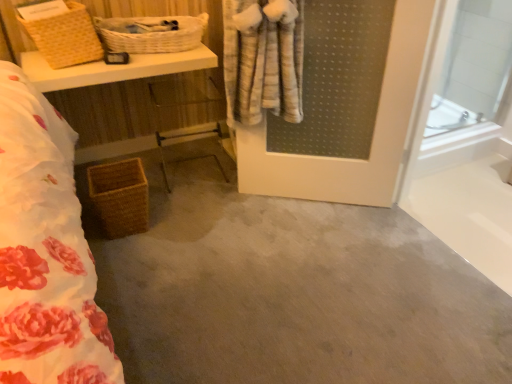
What do you see at coordinates (120, 197) in the screenshot?
I see `woven brown basket at lower left, the third basket in the top-to-bottom sequence` at bounding box center [120, 197].

Describe the element at coordinates (467, 139) in the screenshot. I see `transparent glass door at right` at that location.

The height and width of the screenshot is (384, 512). I want to click on white wicker basket at upper left, which is counted as the 1th basket, starting from the top, so click(151, 33).

The width and height of the screenshot is (512, 384). I want to click on woven brown basket at lower left, the third basket in the top-to-bottom sequence, so click(x=120, y=197).

From a real-world perspective, is white wicker basket at upper left, which is counted as the 1th basket, starting from the top, above or below woven brown basket at upper left, acting as the second basket starting from the bottom?

In terms of real-world spatial position, white wicker basket at upper left, which is counted as the 1th basket, starting from the top, is below woven brown basket at upper left, acting as the second basket starting from the bottom.

The width and height of the screenshot is (512, 384). There is a woven brown basket at upper left, marked as the second basket in a top-to-bottom arrangement. In order to click on the 1st basket below it (from a real-world perspective) in this screenshot , I will do `click(151, 33)`.

Between white wicker basket at upper left, which is counted as the 1th basket, starting from the top, and woven brown basket at upper left, acting as the second basket starting from the bottom, which one has smaller size?

With smaller size is white wicker basket at upper left, which is counted as the 1th basket, starting from the top.

Which object is wider, woven wicker basket at lower left or woven brown basket at upper left, acting as the second basket starting from the bottom?

With larger width is woven wicker basket at lower left.

How far apart are woven wicker basket at lower left and woven brown basket at upper left, marked as the second basket in a top-to-bottom arrangement?

woven wicker basket at lower left and woven brown basket at upper left, marked as the second basket in a top-to-bottom arrangement, are 5.89 inches apart.

Does woven wicker basket at lower left turn towards woven brown basket at upper left, acting as the second basket starting from the bottom?

No.

Is woven wicker basket at lower left positioned behind woven brown basket at upper left, acting as the second basket starting from the bottom?

Yes, woven wicker basket at lower left is further from the camera.

In the scene shown: Considering the relative sizes of transparent glass door at right and woven brown basket at upper left, acting as the second basket starting from the bottom, in the image provided, is transparent glass door at right thinner than woven brown basket at upper left, acting as the second basket starting from the bottom,?

Correct, the width of transparent glass door at right is less than that of woven brown basket at upper left, acting as the second basket starting from the bottom.

Does point (490, 246) appear closer or farther from the camera than point (76, 5)?

Point (490, 246) is positioned closer to the camera compared to point (76, 5).

Considering the sizes of objects transparent glass door at right and woven brown basket at upper left, marked as the second basket in a top-to-bottom arrangement, in the image provided, who is smaller, transparent glass door at right or woven brown basket at upper left, marked as the second basket in a top-to-bottom arrangement,?

woven brown basket at upper left, marked as the second basket in a top-to-bottom arrangement.

Which of these two, woven brown basket at lower left, which is counted as the 1th basket, starting from the bottom, or woven wicker basket at lower left, is bigger?

With larger size is woven wicker basket at lower left.

Does point (118, 190) come in front of point (170, 71)?

Yes, point (118, 190) is closer to viewer.

Is woven brown basket at lower left, which is counted as the 1th basket, starting from the bottom, to the left or to the right of woven wicker basket at lower left in the image?

woven brown basket at lower left, which is counted as the 1th basket, starting from the bottom, is positioned on woven wicker basket at lower left's right side.

Is point (198, 220) positioned before point (111, 81)?

That is False.

From a real-world perspective, relative to woven wicker basket at lower left, is gray carpet at center vertically above or below?

gray carpet at center is situated lower than woven wicker basket at lower left in the real world.

You are a GUI agent. You are given a task and a screenshot of the screen. Output one action in this format:
    pyautogui.click(x=<x>, y=<y>)
    Task: Click on the vanity located behind the gray carpet at center
    
    Given the screenshot: What is the action you would take?
    pyautogui.click(x=114, y=69)

Are gray carpet at center and woven wicker basket at lower left making contact?

gray carpet at center is not next to woven wicker basket at lower left, and they're not touching.

From their relative heights in the image, would you say woven wicker basket at lower left is taller or shorter than gray carpet at center?

In the image, woven wicker basket at lower left appears to be taller than gray carpet at center.

From the image's perspective, is woven wicker basket at lower left on top of gray carpet at center?

Yes, from the image's perspective, woven wicker basket at lower left is on top of gray carpet at center.

From the picture: Is the surface of woven wicker basket at lower left in direct contact with gray carpet at center?

There is a gap between woven wicker basket at lower left and gray carpet at center.

From a real-world perspective, who is located lower, woven wicker basket at lower left or gray carpet at center?

gray carpet at center is physically lower.

From the picture: How different are the orientations of woven wicker basket at lower left and woven brown basket at lower left, the third basket in the top-to-bottom sequence, in degrees?

They differ by 2.78 degrees in their facing directions.

Is woven brown basket at lower left, which is counted as the 1th basket, starting from the bottom, inside woven wicker basket at lower left?

That's incorrect, woven brown basket at lower left, which is counted as the 1th basket, starting from the bottom, is not inside woven wicker basket at lower left.

From the image's perspective, which one is positioned lower, woven wicker basket at lower left or woven brown basket at lower left, which is counted as the 1th basket, starting from the bottom?

woven brown basket at lower left, which is counted as the 1th basket, starting from the bottom.

Considering the relative positions of woven wicker basket at lower left and woven brown basket at lower left, which is counted as the 1th basket, starting from the bottom, in the image provided, is woven wicker basket at lower left to the left of woven brown basket at lower left, which is counted as the 1th basket, starting from the bottom, from the viewer's perspective?

Indeed, woven wicker basket at lower left is positioned on the left side of woven brown basket at lower left, which is counted as the 1th basket, starting from the bottom.

Identify the location of basket above the woven brown basket at upper left, marked as the second basket in a top-to-bottom arrangement (from the image's perspective). (151, 33).

This screenshot has width=512, height=384. Find the location of `vanity to the right of woven brown basket at upper left, marked as the second basket in a top-to-bottom arrangement`. vanity to the right of woven brown basket at upper left, marked as the second basket in a top-to-bottom arrangement is located at coordinates (114, 69).

From the image, which object appears to be nearer to woven wicker basket at lower left, white wicker basket at upper left, which is the 3th basket in bottom-to-top order, or woven brown basket at lower left, which is counted as the 1th basket, starting from the bottom?

white wicker basket at upper left, which is the 3th basket in bottom-to-top order, is positioned closer to the anchor woven wicker basket at lower left.

Estimate the real-world distances between objects in this image. Which object is further from gray carpet at center, woven brown basket at lower left, which is counted as the 1th basket, starting from the bottom, or white wicker basket at upper left, which is counted as the 1th basket, starting from the top?

The object further to gray carpet at center is white wicker basket at upper left, which is counted as the 1th basket, starting from the top.

Considering their positions, is woven brown basket at upper left, acting as the second basket starting from the bottom, positioned further to woven brown basket at lower left, which is counted as the 1th basket, starting from the bottom, than white wicker basket at upper left, which is the 3th basket in bottom-to-top order?

The object further to woven brown basket at lower left, which is counted as the 1th basket, starting from the bottom, is white wicker basket at upper left, which is the 3th basket in bottom-to-top order.

Based on the photo, looking at the image, which one is located further to woven brown basket at lower left, the third basket in the top-to-bottom sequence, woven wicker basket at lower left or white wicker basket at upper left, which is counted as the 1th basket, starting from the top?

Based on the image, white wicker basket at upper left, which is counted as the 1th basket, starting from the top, appears to be further to woven brown basket at lower left, the third basket in the top-to-bottom sequence.

When comparing their distances from woven wicker basket at lower left, does white wicker basket at upper left, which is the 3th basket in bottom-to-top order, or transparent glass door at right seem further?

Based on the image, transparent glass door at right appears to be further to woven wicker basket at lower left.

Considering their positions, is woven brown basket at lower left, which is counted as the 1th basket, starting from the bottom, positioned closer to gray carpet at center than woven wicker basket at lower left?

Based on the image, woven brown basket at lower left, which is counted as the 1th basket, starting from the bottom, appears to be nearer to gray carpet at center.

Considering their positions, is gray carpet at center positioned further to woven wicker basket at lower left than transparent glass door at right?

transparent glass door at right.

Based on the photo, based on their spatial positions, is white wicker basket at upper left, which is counted as the 1th basket, starting from the top, or woven brown basket at lower left, which is counted as the 1th basket, starting from the bottom, closer to transparent glass door at right?

Among the two, white wicker basket at upper left, which is counted as the 1th basket, starting from the top, is located nearer to transparent glass door at right.

Image resolution: width=512 pixels, height=384 pixels. I want to click on vanity situated between woven brown basket at upper left, marked as the second basket in a top-to-bottom arrangement, and transparent glass door at right from left to right, so click(114, 69).

The image size is (512, 384). I want to click on concrete between woven brown basket at lower left, the third basket in the top-to-bottom sequence, and transparent glass door at right, in the horizontal direction, so click(x=291, y=291).

Identify the location of basket between white wicker basket at upper left, which is the 3th basket in bottom-to-top order, and woven brown basket at lower left, which is counted as the 1th basket, starting from the bottom, in the vertical direction. The width and height of the screenshot is (512, 384). (66, 37).

Where is `concrete between woven wicker basket at lower left and transparent glass door at right from left to right`? The width and height of the screenshot is (512, 384). concrete between woven wicker basket at lower left and transparent glass door at right from left to right is located at coordinates (291, 291).